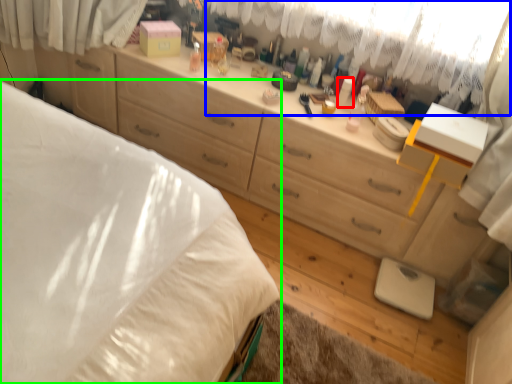
Question: Which object is positioned closest to toiletry (highlighted by a red box)? Select from curtain (highlighted by a blue box) and bed (highlighted by a green box).

Choices:
 (A) curtain
 (B) bed

Answer: (A)